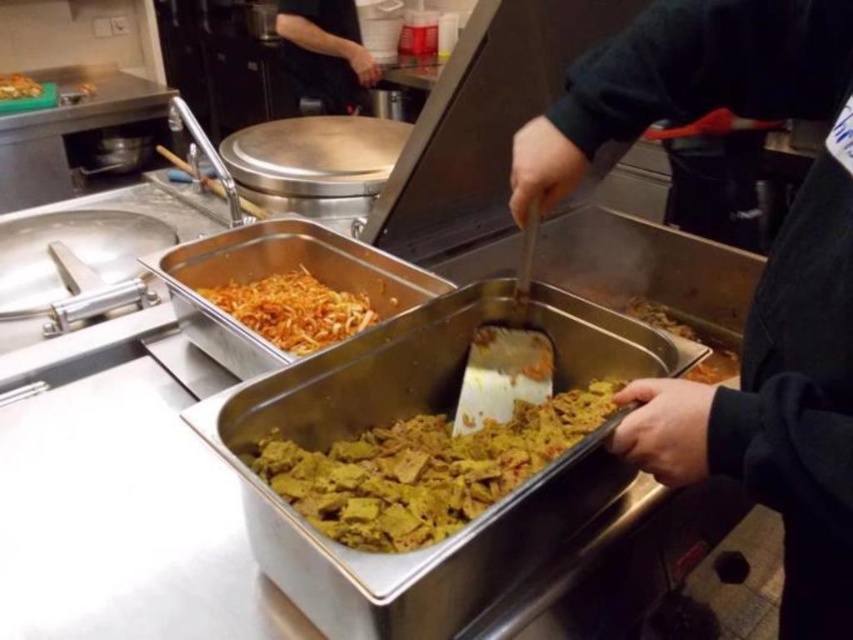
Question: Is yellowish matte shredded vegetables at center to the left of shiny orange shredded vegetables at upper left from the viewer's perspective?

Choices:
 (A) yes
 (B) no

Answer: (B)

Question: Which object is closer to the camera taking this photo?

Choices:
 (A) black fabric at upper center
 (B) shiny orange shredded vegetables at upper left
 (C) yellowish matte shredded vegetables at center

Answer: (C)

Question: Which of the following is the closest to the observer?

Choices:
 (A) (399, 497)
 (B) (33, 90)

Answer: (A)

Question: Can you confirm if dark gray sweater at center is bigger than yellowish matte rectangular food at center?

Choices:
 (A) no
 (B) yes

Answer: (B)

Question: Among these points, which one is nearest to the camera?

Choices:
 (A) (343, 104)
 (B) (15, 92)
 (C) (844, 28)

Answer: (C)

Question: Is yellowish matte rectangular food at center to the right of shiny orange shredded vegetables at upper left from the viewer's perspective?

Choices:
 (A) no
 (B) yes

Answer: (B)